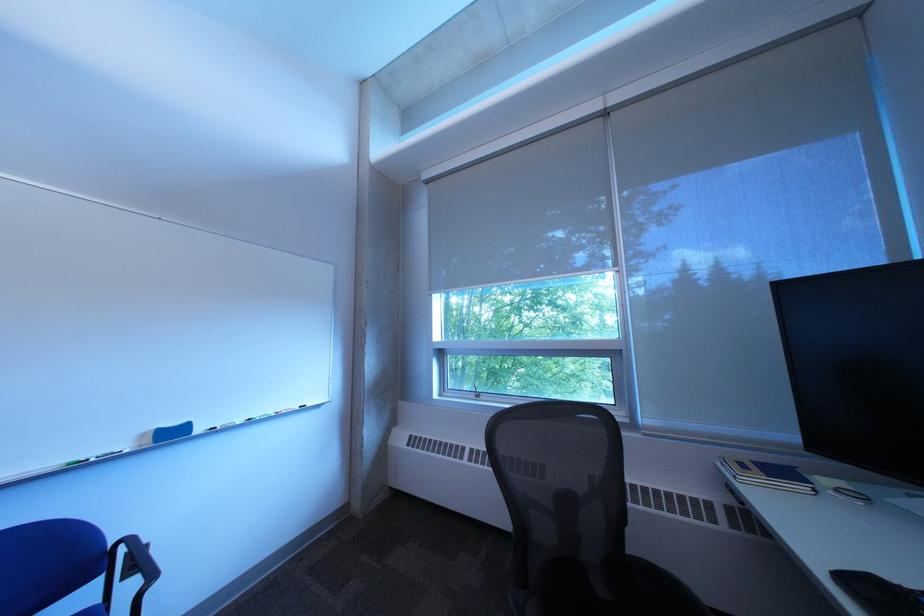
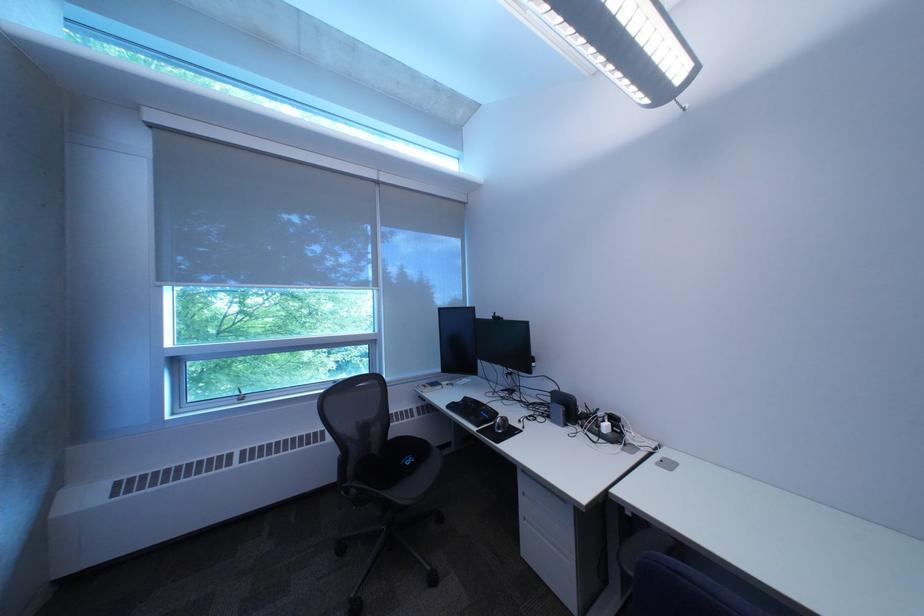
The point at [625,361] is marked in the first image. Where is the corresponding point in the second image?

(383, 347)